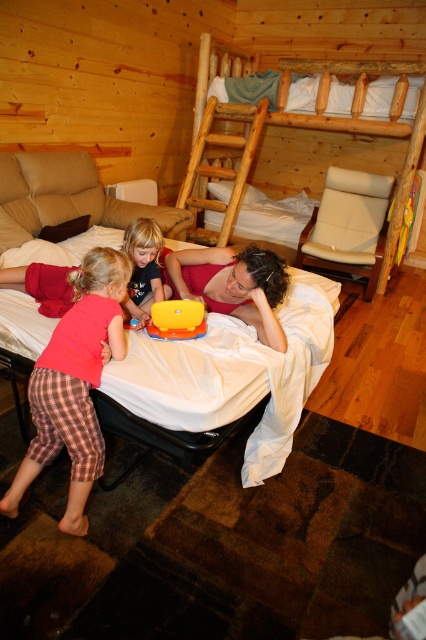
Question: Can you confirm if wooden ladder at center is bigger than yellow plastic toy at center?

Choices:
 (A) yes
 (B) no

Answer: (A)

Question: Considering the relative positions of wooden bunk bed at upper center and matte pink shirt at center in the image provided, where is wooden bunk bed at upper center located with respect to matte pink shirt at center?

Choices:
 (A) left
 (B) right

Answer: (B)

Question: Among these points, which one is nearest to the camera?

Choices:
 (A) (207, 173)
 (B) (127, 372)

Answer: (B)

Question: Which point appears farthest from the camera in this image?

Choices:
 (A) (400, 83)
 (B) (218, 198)

Answer: (B)

Question: Estimate the real-world distances between objects in this image. Which object is farther from the plaid cotton pants at lower left?

Choices:
 (A) matte pink shirt at center
 (B) white soft pillow at upper center
 (C) yellow plastic toy at center
 (D) wooden bunk bed at upper center

Answer: (B)

Question: Is white soft mattress at center smaller than matte red dress at center?

Choices:
 (A) yes
 (B) no

Answer: (B)